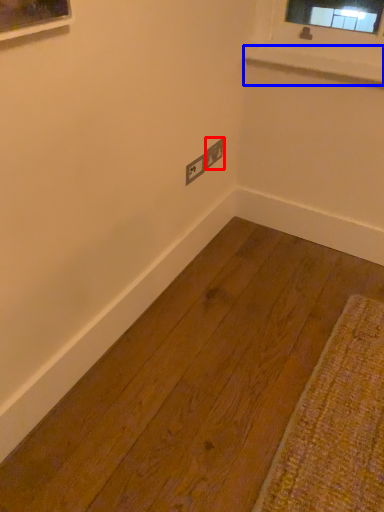
Question: Which point is closer to the camera, electric outlet (highlighted by a red box) or window sill (highlighted by a blue box)?

Choices:
 (A) electric outlet
 (B) window sill

Answer: (B)